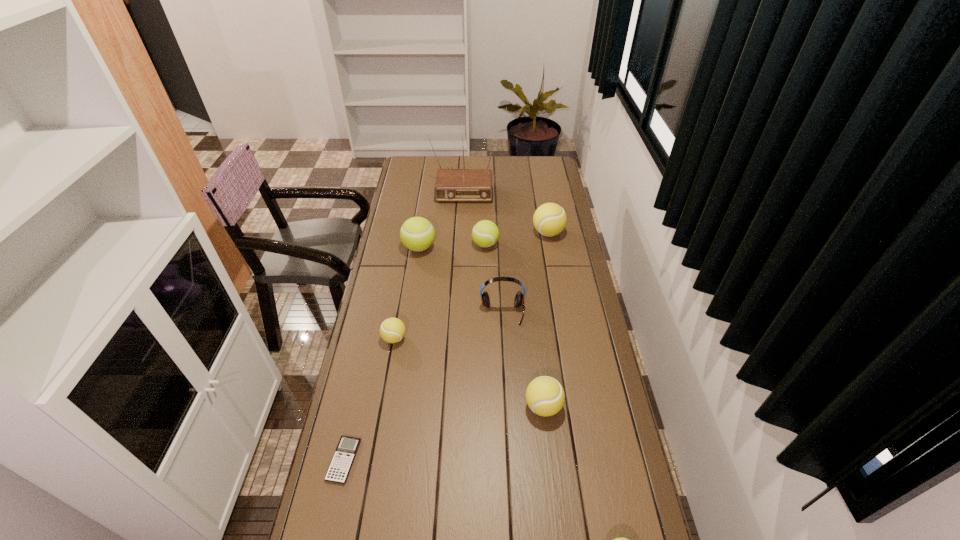
I want to click on the tallest object, so click(x=451, y=185).

At what (x,y) coordinates should I click in order to perform the action: click on the farthest object. Please return your answer as a coordinate pair (x, y). Looking at the image, I should click on (451, 185).

I want to click on the biggest yellow tennis ball, so click(549, 219).

Find the location of a particular element. Image resolution: width=960 pixels, height=540 pixels. the biggest green tennis ball is located at coordinates (417, 233).

The image size is (960, 540). Find the location of `red headset`. red headset is located at coordinates (519, 298).

Locate an element on the screen. This screenshot has height=540, width=960. headset is located at coordinates (519, 298).

Locate an element on the screen. The image size is (960, 540). the second nearest tennis ball is located at coordinates (545, 396).

This screenshot has height=540, width=960. I want to click on the second biggest yellow tennis ball, so click(x=545, y=396).

Identify the location of the third tennis ball from left to right. (485, 233).

Where is `the second green tennis ball from right to left`? Image resolution: width=960 pixels, height=540 pixels. the second green tennis ball from right to left is located at coordinates (485, 233).